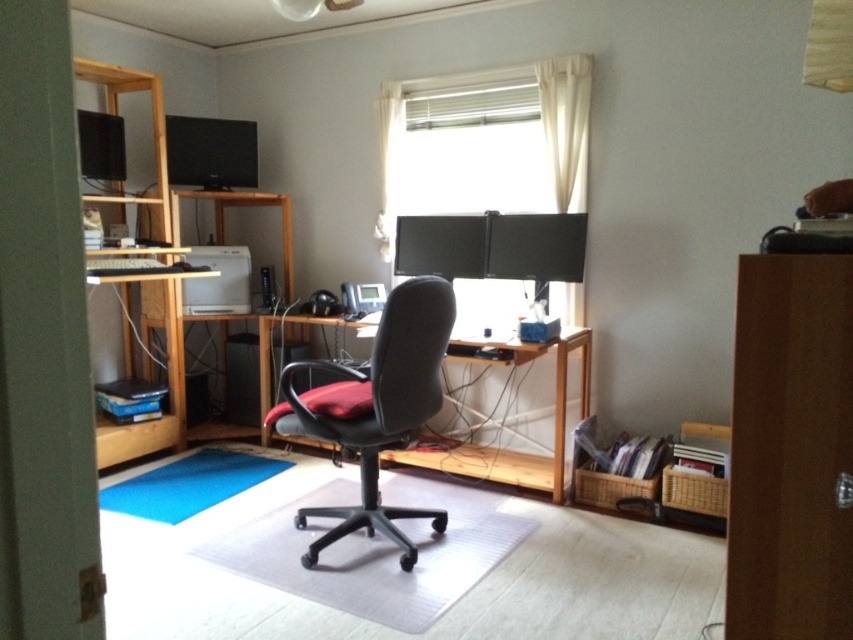
Question: Among these objects, which one is nearest to the camera?

Choices:
 (A) clear plastic mat at center
 (B) blue carpet at lower left
 (C) matte black swivel chair at center
 (D) wooden desk at center

Answer: (A)

Question: Which object is positioned closest to the wooden desk at center?

Choices:
 (A) wooden bookshelf at left
 (B) clear plastic mat at center
 (C) satin black monitor at upper left
 (D) blue carpet at lower left

Answer: (B)

Question: Is clear plastic mat at center further to camera compared to matte black swivel chair at center?

Choices:
 (A) yes
 (B) no

Answer: (B)

Question: Which point is farther to the camera?

Choices:
 (A) wooden bookshelf at left
 (B) clear plastic mat at center
 (C) matte black swivel chair at center

Answer: (A)

Question: Can you confirm if matte black swivel chair at center is positioned to the right of blue carpet at lower left?

Choices:
 (A) yes
 (B) no

Answer: (A)

Question: Is clear plastic mat at center to the left of wooden desk at center from the viewer's perspective?

Choices:
 (A) no
 (B) yes

Answer: (B)